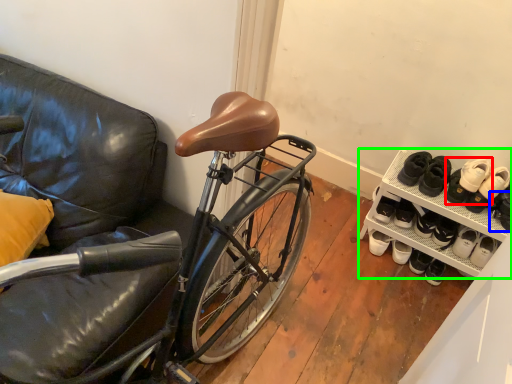
Question: Estimate the real-world distances between objects in this image. Which object is farther from footwear (highlighted by a red box), shoe (highlighted by a blue box) or cabinetry (highlighted by a green box)?

Choices:
 (A) shoe
 (B) cabinetry

Answer: (B)